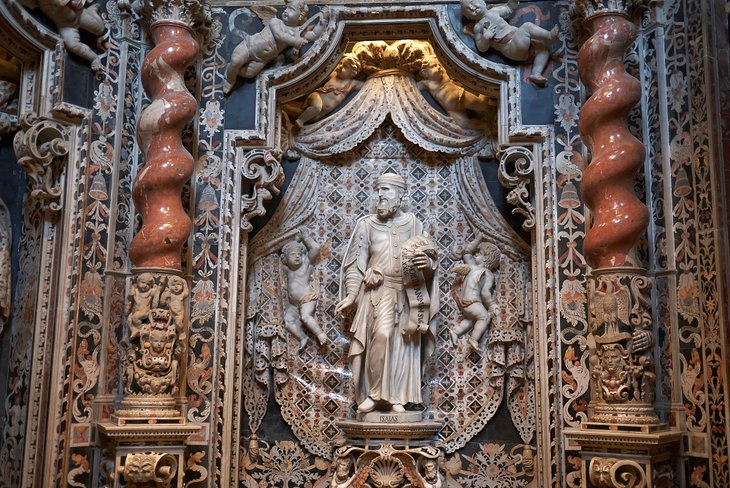
You are a GUI agent. You are given a task and a screenshot of the screen. Output one action in this format:
    pyautogui.click(x=<x>, y=<y>)
    Task: Click on the statue
    
    Given the screenshot: What is the action you would take?
    pyautogui.click(x=385, y=306)